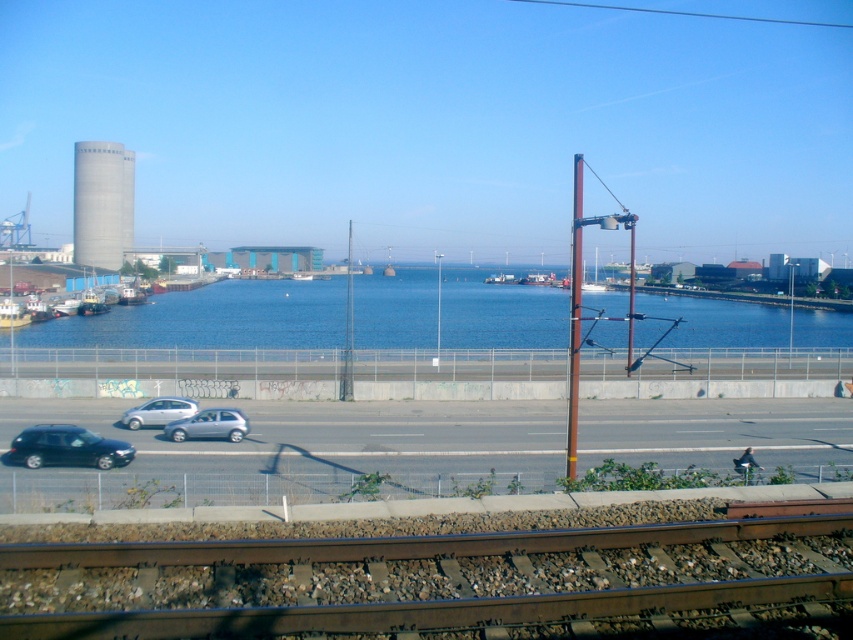
Does shiny black car at lower left appear under satin silver hatchback at lower center?

Indeed, shiny black car at lower left is positioned under satin silver hatchback at lower center.

This screenshot has height=640, width=853. In order to click on shiny black car at lower left in this screenshot , I will do `click(67, 448)`.

Between gray concrete water tower at left and satin silver hatchback at lower center, which one appears on the left side from the viewer's perspective?

gray concrete water tower at left is more to the left.

Does gray concrete water tower at left have a greater width compared to satin silver hatchback at lower center?

Yes.

Does point (119, 195) lie behind point (196, 428)?

That is True.

The image size is (853, 640). Identify the location of gray concrete water tower at left. (102, 202).

Who is higher up, shiny black car at lower left or silver metallic hatchback at lower left?

silver metallic hatchback at lower left is higher up.

Which of these two, shiny black car at lower left or silver metallic hatchback at lower left, stands shorter?

With less height is shiny black car at lower left.

Which is behind, point (131, 445) or point (136, 412)?

Positioned behind is point (136, 412).

The width and height of the screenshot is (853, 640). Identify the location of shiny black car at lower left. (67, 448).